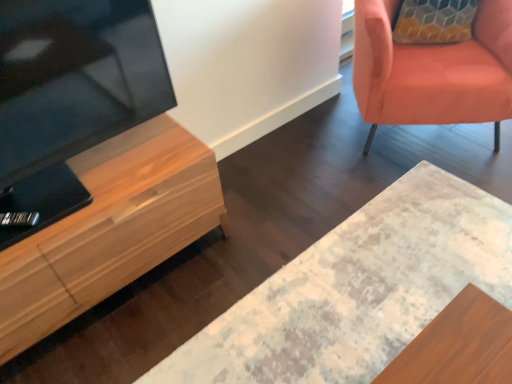
Question: Is distressed wood desk at center to the right of light wood cabinet at left from the viewer's perspective?

Choices:
 (A) yes
 (B) no

Answer: (A)

Question: Is distressed wood desk at center beside light wood cabinet at left?

Choices:
 (A) yes
 (B) no

Answer: (B)

Question: From a real-world perspective, is distressed wood desk at center under light wood cabinet at left?

Choices:
 (A) no
 (B) yes

Answer: (B)

Question: Is distressed wood desk at center positioned before light wood cabinet at left?

Choices:
 (A) no
 (B) yes

Answer: (B)

Question: Is distressed wood desk at center shorter than light wood cabinet at left?

Choices:
 (A) no
 (B) yes

Answer: (B)

Question: Is distressed wood desk at center oriented towards light wood cabinet at left?

Choices:
 (A) no
 (B) yes

Answer: (A)

Question: Is matte orange chair at upper right located outside light wood cabinet at left?

Choices:
 (A) no
 (B) yes

Answer: (B)

Question: Is matte orange chair at upper right directly adjacent to light wood cabinet at left?

Choices:
 (A) no
 (B) yes

Answer: (A)

Question: Considering the relative positions of matte orange chair at upper right and light wood cabinet at left in the image provided, is matte orange chair at upper right to the left of light wood cabinet at left from the viewer's perspective?

Choices:
 (A) no
 (B) yes

Answer: (A)

Question: From a real-world perspective, is matte orange chair at upper right positioned over light wood cabinet at left based on gravity?

Choices:
 (A) yes
 (B) no

Answer: (A)

Question: From the image's perspective, does matte orange chair at upper right appear higher than light wood cabinet at left?

Choices:
 (A) no
 (B) yes

Answer: (B)

Question: Is light wood cabinet at left inside matte orange chair at upper right?

Choices:
 (A) no
 (B) yes

Answer: (A)

Question: From a real-world perspective, is distressed wood desk at center located beneath matte orange chair at upper right?

Choices:
 (A) yes
 (B) no

Answer: (A)